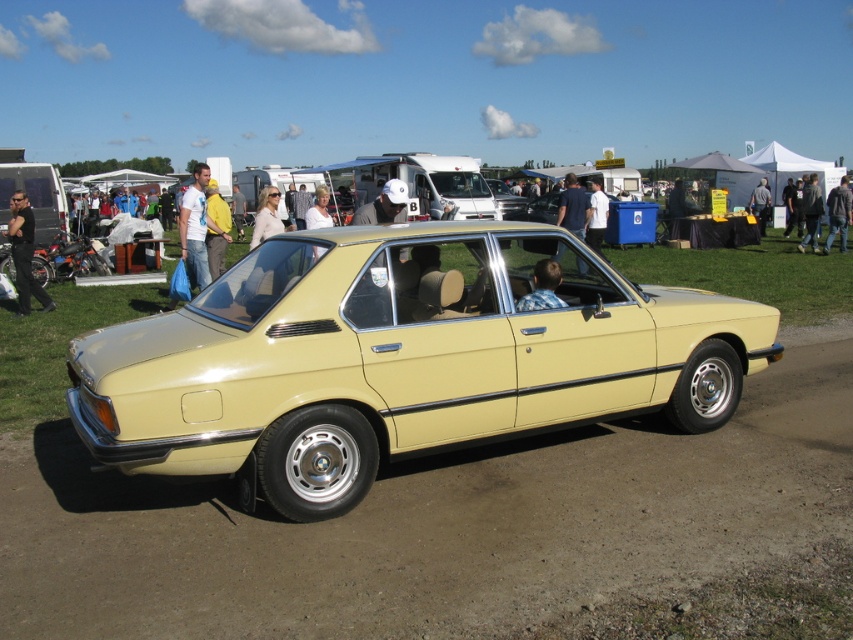
You are standing at the point marked by the coordinates point (573, 205) in the image. Looking around, you see the vintage BMW sedan parked on a dirt surface. What object is located exactly at your current position?

The point (573, 205) corresponds to the blue denim shirt at center.

You are standing at the entrance of the car show and see the vintage BMW sedan and the blue denim shirt at center. Which object is closer to you?

The blue denim shirt at center is closer to you because it is located at point 0.323 in the x coordinate, which is closer to the entrance compared to the vintage BMW sedan.